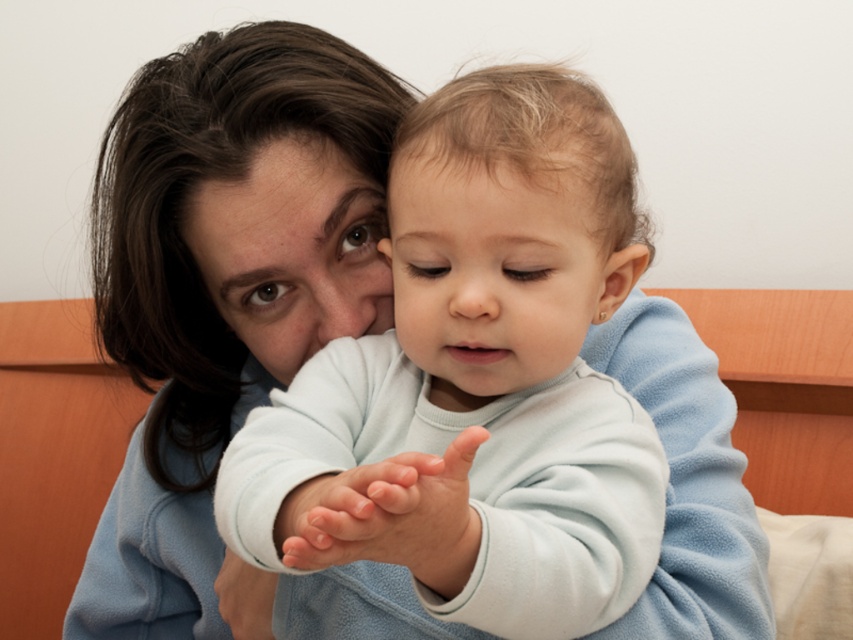
Question: Can you confirm if light blue fleece at center is thinner than smooth white hand at center?

Choices:
 (A) yes
 (B) no

Answer: (B)

Question: Can you confirm if smooth white hand at center is bigger than smooth skin forehead at center?

Choices:
 (A) yes
 (B) no

Answer: (A)

Question: Which point is farther from the camera taking this photo?

Choices:
 (A) (451, 193)
 (B) (384, 380)

Answer: (B)

Question: Does smooth white hand at center have a lesser width compared to smooth skin hand at center?

Choices:
 (A) yes
 (B) no

Answer: (B)

Question: Considering the real-world distances, which object is farthest from the smooth skin hand at center?

Choices:
 (A) smooth skin forehead at center
 (B) light blue fleece at center

Answer: (A)

Question: Which object is positioned closest to the smooth skin forehead at center?

Choices:
 (A) smooth white hand at center
 (B) light blue fleece at center
 (C) smooth skin hand at center

Answer: (B)